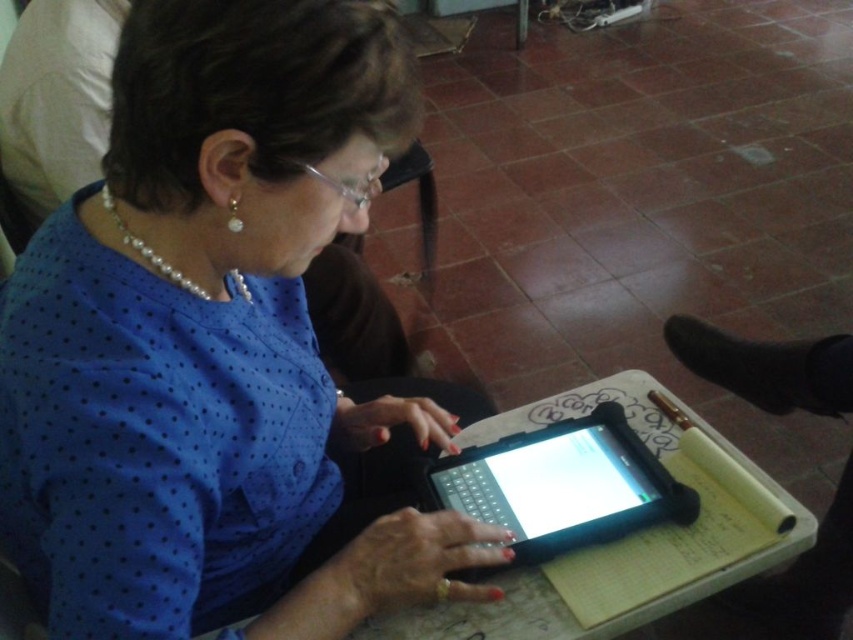
You are a photographer taking a picture of the blue dotted shirt at center and the black rubberized tablet at center. Which object should you focus on first if you want to ensure both are in focus, considering their positions?

The blue dotted shirt at center is above the black rubberized tablet at center, so focusing on the shirt first will help ensure both are in focus as the tablet is below it.

In the scene shown: You are an interior designer planning to place a new decorative item on the table where the blue dotted shirt at center and the black rubberized tablet at center are located. Considering their sizes, which object should you avoid covering to ensure the decorative item doesn t block both?

The blue dotted shirt at center is larger in size than the black rubberized tablet at center, so you should avoid covering the blue dotted shirt at center to ensure the decorative item doesn t block both.